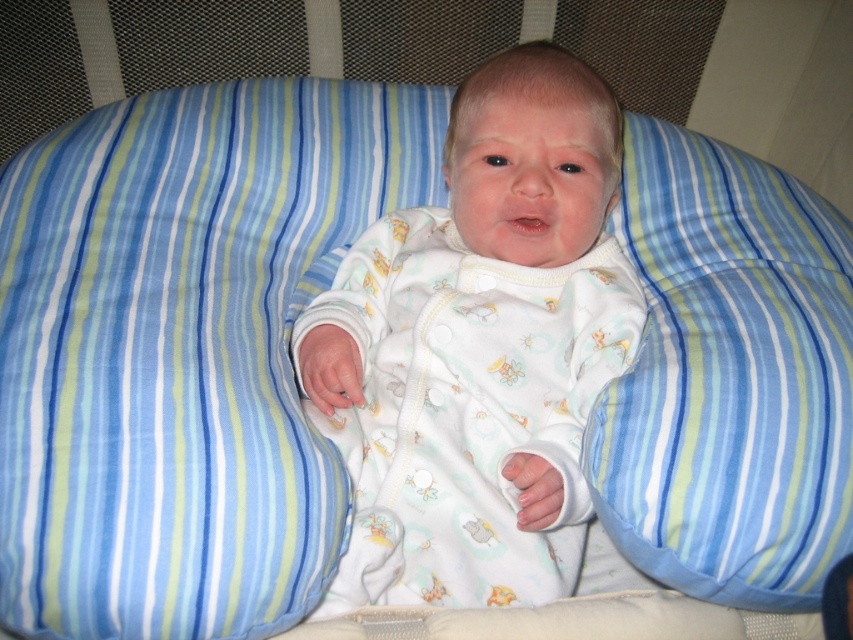
You are a photographer setting up for a baby photoshoot. You need to adjust the lighting so that the white soft fabric baby at center and the blue striped pillow at center are both well illuminated. Considering their sizes, which object might require more focused lighting adjustments?

The white soft fabric baby at center is much taller than the blue striped pillow at center, so it might require more focused lighting adjustments to ensure proper illumination across its entire height.

You are a photographer setting up for a baby photoshoot. You have a white soft fabric baby at center and a blue striped pillow at center in the scene. The baby needs to be positioned so that it appears larger in the photo. Which object should you move closer to the camera to achieve this effect?

To make the white soft fabric baby at center appear larger in the photo, you should move the white soft fabric baby at center closer to the camera. Since the baby is smaller than the blue striped pillow at center, moving it closer will magnify its size relative to the pillow and the frame.

You are a photographer wanting to capture a closeup of the white soft fabric baby at center. Your camera has a minimum focusing distance of 60 centimeters. Can you take the photo without moving either the camera or the baby?

The white soft fabric baby at center and camera are 72.23 centimeters apart, which is beyond the minimum focusing distance of 60 centimeters. Therefore, you can take the photo without moving either the camera or the baby.